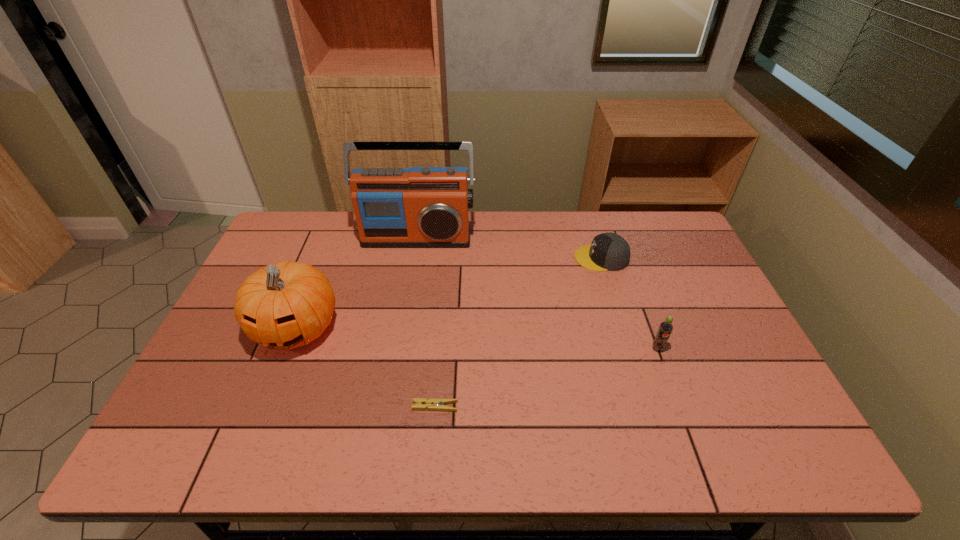
The width and height of the screenshot is (960, 540). Identify the location of vacant area situated on the front-facing side of the fourth tallest object. pos(532,258).

This screenshot has width=960, height=540. What are the coordinates of `vacant position located 0.270m on the front-facing side of the fourth tallest object` in the screenshot? It's located at (492, 258).

You are a GUI agent. You are given a task and a screenshot of the screen. Output one action in this format:
    pyautogui.click(x=<x>, y=<y>)
    Task: Click on the vacant space situated 0.330m on the back of the shortest object
    
    Given the screenshot: What is the action you would take?
    pyautogui.click(x=444, y=302)

Find the location of a particular element. This screenshot has width=960, height=540. radio receiver that is at the far edge is located at coordinates (419, 207).

What are the coordinates of `cap located in the far edge section of the desktop` in the screenshot? It's located at (608, 251).

Where is `object at the left edge`? This screenshot has width=960, height=540. object at the left edge is located at coordinates (285, 305).

Identify the location of free space at the far edge. (559, 227).

What are the coordinates of `vacant area at the near edge of the desktop` in the screenshot? It's located at (633, 442).

Identify the location of vacant space at the left edge. (235, 421).

You are a GUI agent. You are given a task and a screenshot of the screen. Output one action in this format:
    pyautogui.click(x=<x>, y=<y>)
    Task: Click on the free space at the far left corner of the desktop
    This screenshot has width=960, height=540.
    Given the screenshot: What is the action you would take?
    pyautogui.click(x=286, y=253)